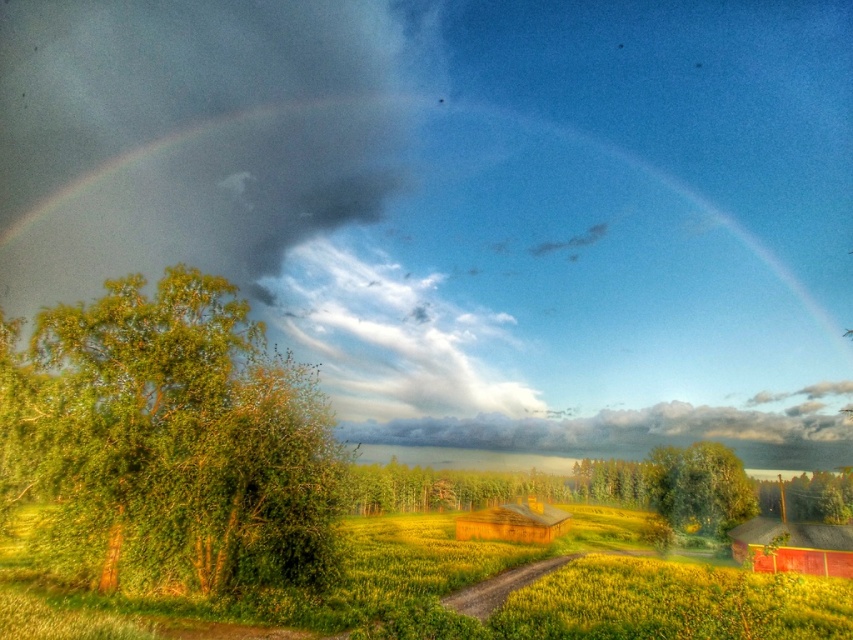
Question: Can you confirm if green grassy field at lower center is positioned above wooden barn at lower right?

Choices:
 (A) no
 (B) yes

Answer: (A)

Question: Which point is farther from the camera taking this photo?

Choices:
 (A) (165, 611)
 (B) (790, 534)
 (C) (474, 515)
 (D) (788, 508)

Answer: (D)

Question: Among these points, which one is farthest from the camera?

Choices:
 (A) (114, 365)
 (B) (345, 600)

Answer: (B)

Question: Based on their relative distances, which object is nearer to the wooden barn at center?

Choices:
 (A) green leafy tree at center
 (B) wooden barn at lower right

Answer: (A)

Question: Does green leafy tree at center have a smaller size compared to wooden barn at lower right?

Choices:
 (A) yes
 (B) no

Answer: (B)

Question: Can you confirm if wooden barn at lower right is positioned below green leafy tree at lower right?

Choices:
 (A) yes
 (B) no

Answer: (B)